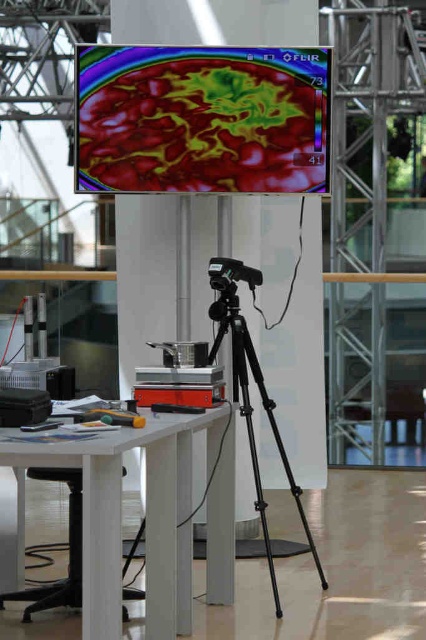
Question: Which of these objects is positioned closest to the white matte table at lower left?

Choices:
 (A) black plastic video camera at center
 (B) thermal imaging screen at center
 (C) black plastic stool at lower left
 (D) black metal tripod at center

Answer: (D)

Question: Considering the real-world distances, which object is farthest from the black plastic video camera at center?

Choices:
 (A) thermal imaging screen at center
 (B) black metal tripod at center
 (C) black plastic stool at lower left

Answer: (C)

Question: Which object appears farthest from the camera in this image?

Choices:
 (A) white matte table at lower left
 (B) black plastic video camera at center
 (C) thermal imaging screen at center
 (D) black metal tripod at center

Answer: (C)

Question: Where is thermal imaging screen at center located in relation to black plastic stool at lower left in the image?

Choices:
 (A) right
 (B) left

Answer: (A)

Question: Is white matte table at lower left further to the viewer compared to black plastic stool at lower left?

Choices:
 (A) no
 (B) yes

Answer: (A)

Question: Does black metal tripod at center appear over black plastic stool at lower left?

Choices:
 (A) yes
 (B) no

Answer: (A)